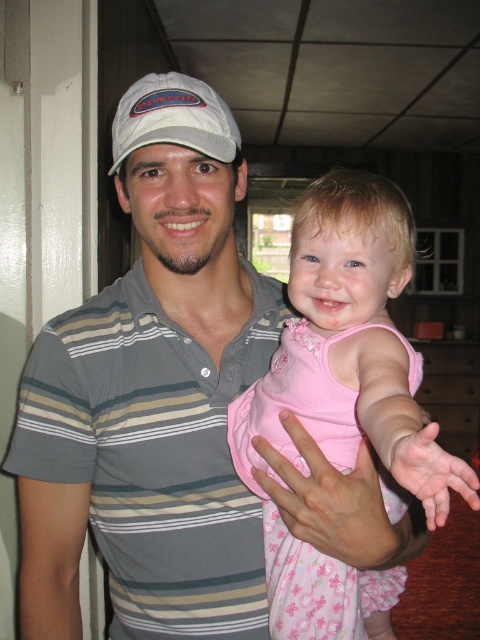
Which of these two, pink satin dress at center or white fabric baseball cap at upper center, stands shorter?

Standing shorter between the two is white fabric baseball cap at upper center.

Between point (315, 634) and point (147, 124), which one is positioned in front?

Point (147, 124) is more forward.

At what (x,y) coordinates should I click in order to perform the action: click on pink satin dress at center. Please return your answer as a coordinate pair (x, y). Looking at the image, I should click on (342, 396).

In the scene shown: Is pink satin dress at center taller than gray striped shirt at left?

Yes, pink satin dress at center is taller than gray striped shirt at left.

From the picture: Can you confirm if pink satin dress at center is bigger than gray striped shirt at left?

Yes.

Does point (433, 520) lie in front of point (64, 419)?

Yes.

This screenshot has width=480, height=640. What are the coordinates of `pink satin dress at center` in the screenshot? It's located at (342, 396).

Is point (183, 561) less distant than point (278, 625)?

No.

Is striped cotton polo shirt at center above pink satin dress at center?

Yes.

Who is more distant from viewer, [61,429] or [472,502]?

The point [61,429] is behind.

What are the coordinates of `striped cotton polo shirt at center` in the screenshot? It's located at (154, 456).